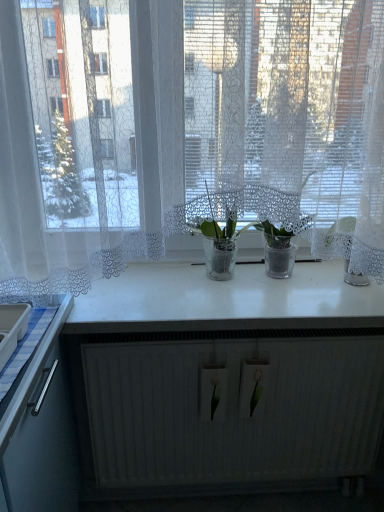
I want to click on vacant space in front of translucent glass vase at center, so click(222, 303).